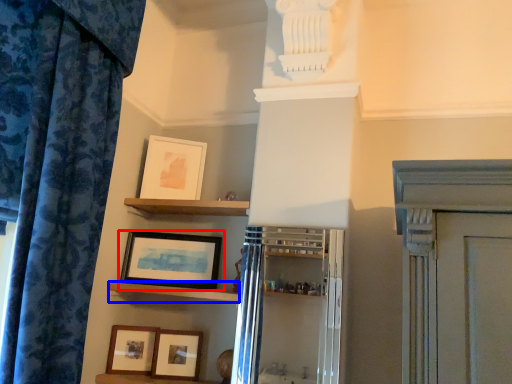
Question: Which object is closer to the camera taking this photo, picture frame (highlighted by a red box) or shelf (highlighted by a blue box)?

Choices:
 (A) picture frame
 (B) shelf

Answer: (B)